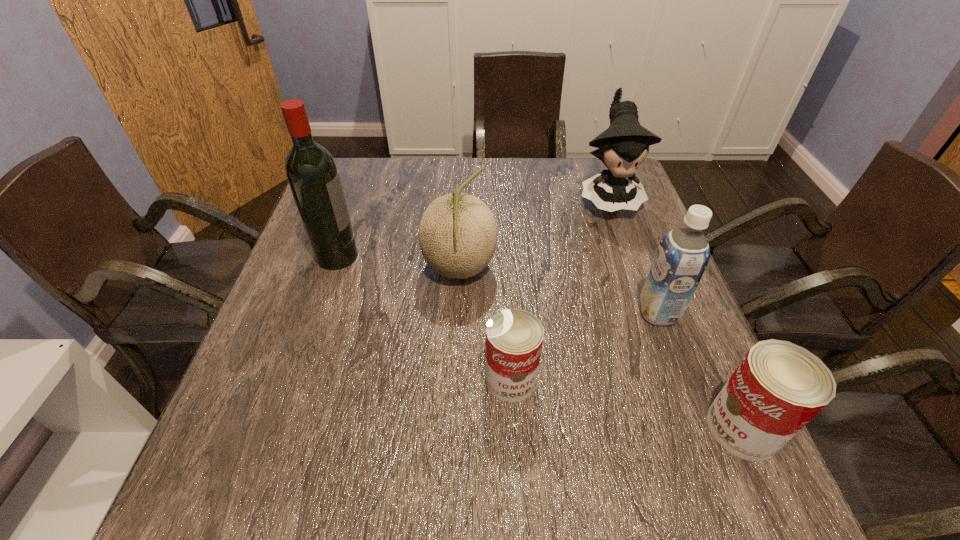
The cans are evenly distributed in the image. To maintain this, where would you place another can on the left? Please point to a free space. Please provide its 2D coordinates. Your answer should be formatted as a tuple, i.e. [(x, y)], where the tuple contains the x and y coordinates of a point satisfying the conditions above.

[(315, 337)]